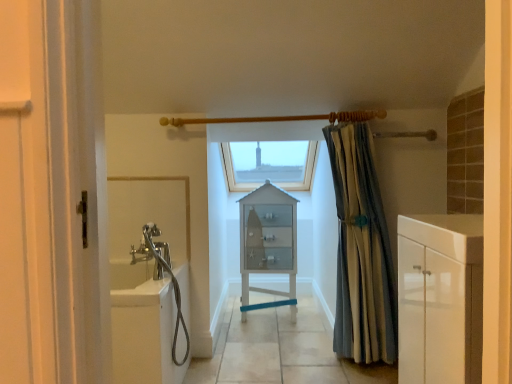
Where is `blank space situated above white tile floor at center (from a real-world perspective)`? Image resolution: width=512 pixels, height=384 pixels. blank space situated above white tile floor at center (from a real-world perspective) is located at coordinates (276, 340).